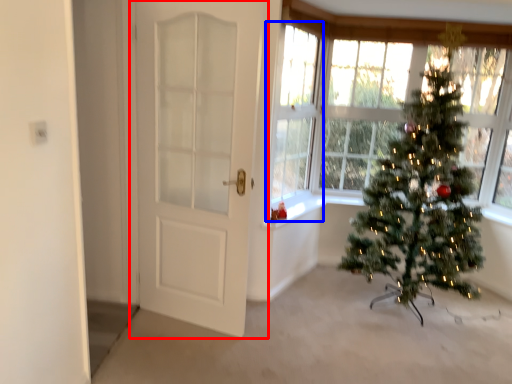
Question: Which of the following is the closest to the observer, door (highlighted by a red box) or window (highlighted by a blue box)?

Choices:
 (A) door
 (B) window

Answer: (A)